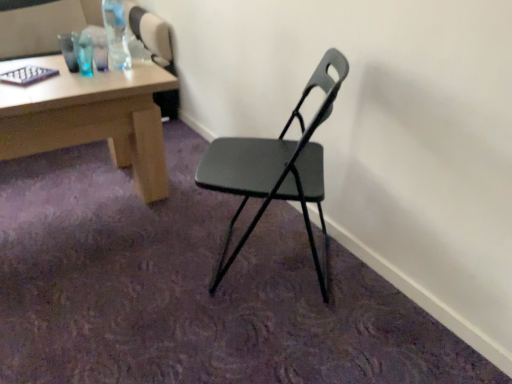
Where is `free space behind matte black chair at center`? free space behind matte black chair at center is located at coordinates (228, 206).